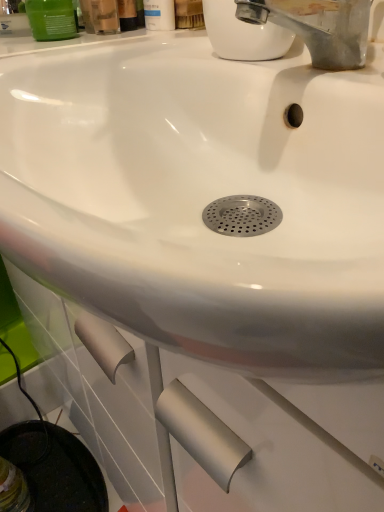
Question: Is green matte container at upper left, marked as the 3th mouthwash in a right-to-left arrangement, oriented away from matte plastic mouthwash at upper center, positioned as the second mouthwash in left-to-right order?

Choices:
 (A) no
 (B) yes

Answer: (B)

Question: Does green matte container at upper left, the 1th mouthwash positioned from the left, have a larger size compared to matte plastic mouthwash at upper center, arranged as the 2th mouthwash when viewed from the right?

Choices:
 (A) no
 (B) yes

Answer: (A)

Question: Can you confirm if green matte container at upper left, the 1th mouthwash positioned from the left, is wider than matte plastic mouthwash at upper center, arranged as the 2th mouthwash when viewed from the right?

Choices:
 (A) yes
 (B) no

Answer: (B)

Question: Can you see green matte container at upper left, marked as the 3th mouthwash in a right-to-left arrangement, touching matte plastic mouthwash at upper center, positioned as the second mouthwash in left-to-right order?

Choices:
 (A) no
 (B) yes

Answer: (B)

Question: From the image's perspective, does green matte container at upper left, the 1th mouthwash positioned from the left, appear lower than matte plastic mouthwash at upper center, arranged as the 2th mouthwash when viewed from the right?

Choices:
 (A) yes
 (B) no

Answer: (A)

Question: Is the position of green matte container at upper left, marked as the 3th mouthwash in a right-to-left arrangement, less distant than that of matte plastic mouthwash at upper center, arranged as the 2th mouthwash when viewed from the right?

Choices:
 (A) yes
 (B) no

Answer: (B)

Question: From a real-world perspective, is white matte bottle at upper center, placed as the third mouthwash when sorted from left to right, physically above green matte container at upper left, the 1th mouthwash positioned from the left?

Choices:
 (A) yes
 (B) no

Answer: (A)

Question: Considering the relative sizes of white matte bottle at upper center, the 1th mouthwash when ordered from right to left, and green matte container at upper left, the 1th mouthwash positioned from the left, in the image provided, is white matte bottle at upper center, the 1th mouthwash when ordered from right to left, wider than green matte container at upper left, the 1th mouthwash positioned from the left,?

Choices:
 (A) no
 (B) yes

Answer: (A)

Question: Does white matte bottle at upper center, the 1th mouthwash when ordered from right to left, have a larger size compared to green matte container at upper left, marked as the 3th mouthwash in a right-to-left arrangement?

Choices:
 (A) yes
 (B) no

Answer: (A)

Question: From the image's perspective, does white matte bottle at upper center, placed as the third mouthwash when sorted from left to right, appear lower than green matte container at upper left, the 1th mouthwash positioned from the left?

Choices:
 (A) yes
 (B) no

Answer: (B)

Question: Considering the relative sizes of white matte bottle at upper center, placed as the third mouthwash when sorted from left to right, and green matte container at upper left, the 1th mouthwash positioned from the left, in the image provided, is white matte bottle at upper center, placed as the third mouthwash when sorted from left to right, thinner than green matte container at upper left, the 1th mouthwash positioned from the left,?

Choices:
 (A) yes
 (B) no

Answer: (A)

Question: Is white matte bottle at upper center, the 1th mouthwash when ordered from right to left, in front of green matte container at upper left, marked as the 3th mouthwash in a right-to-left arrangement?

Choices:
 (A) no
 (B) yes

Answer: (A)

Question: From a real-world perspective, is green matte container at upper left, the 1th mouthwash positioned from the left, located beneath white matte bottle at upper center, placed as the third mouthwash when sorted from left to right?

Choices:
 (A) no
 (B) yes

Answer: (B)